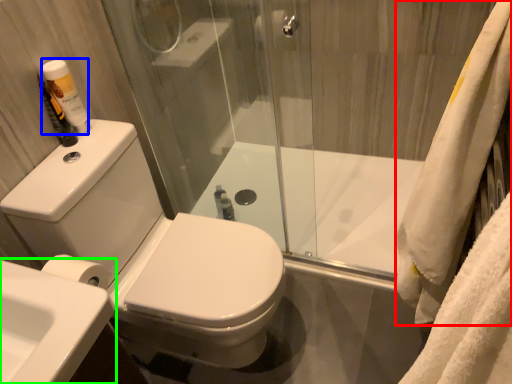
Question: Which is farther away from bath towel (highlighted by a red box)? toiletry (highlighted by a blue box) or sink (highlighted by a green box)?

Choices:
 (A) toiletry
 (B) sink

Answer: (A)